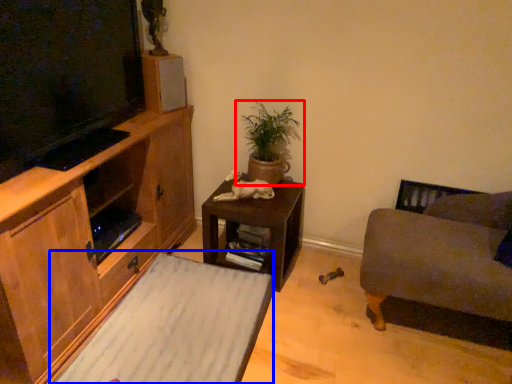
Question: Among these objects, which one is farthest to the camera, houseplant (highlighted by a red box) or plain (highlighted by a blue box)?

Choices:
 (A) houseplant
 (B) plain

Answer: (A)